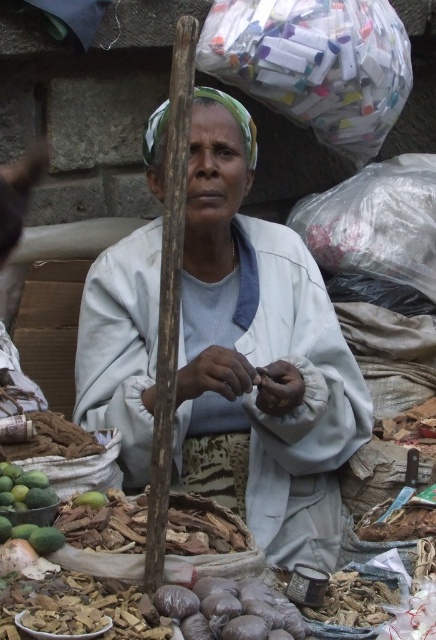
Question: Which object appears farthest from the camera in this image?

Choices:
 (A) green matte mangoes at lower left
 (B) white cloth at center

Answer: (B)

Question: Is white cloth at center positioned at the back of green matte mangoes at lower left?

Choices:
 (A) yes
 (B) no

Answer: (A)

Question: Is white cloth at center below green matte mangoes at lower left?

Choices:
 (A) yes
 (B) no

Answer: (B)

Question: Can you confirm if white cloth at center is positioned below green matte mangoes at lower left?

Choices:
 (A) no
 (B) yes

Answer: (A)

Question: Among these objects, which one is farthest from the camera?

Choices:
 (A) green matte mangoes at lower left
 (B) white cloth at center

Answer: (B)